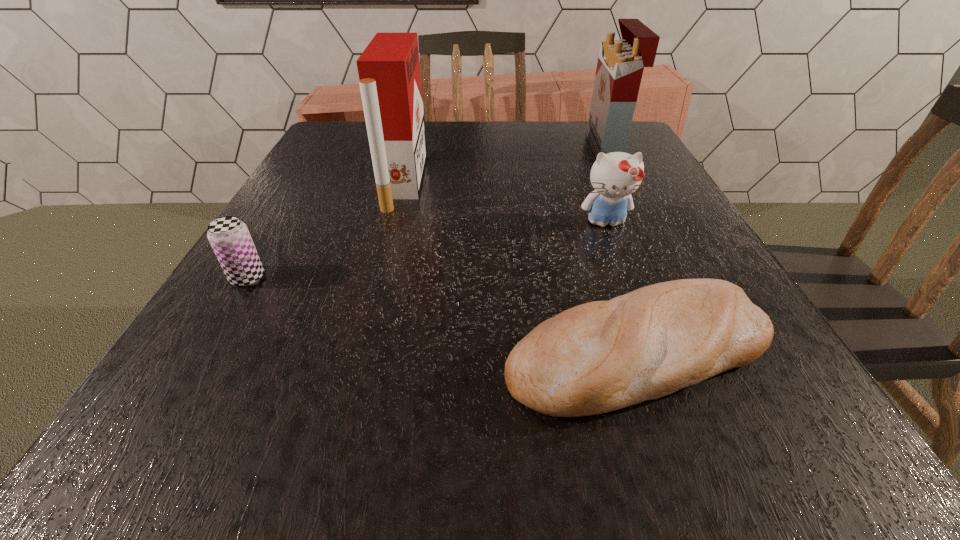
Find the location of a particular element. Image resolution: width=960 pixels, height=540 pixels. object that is at the near right corner is located at coordinates (601, 356).

Find the location of a particular element. The height and width of the screenshot is (540, 960). vacant space at the far edge of the desktop is located at coordinates (571, 136).

Locate an element on the screen. The height and width of the screenshot is (540, 960). free space at the left edge of the desktop is located at coordinates (300, 308).

I want to click on free region at the right edge, so click(x=656, y=177).

Find the location of a particular element. vacant region at the far left corner of the desktop is located at coordinates (x=351, y=121).

You are a GUI agent. You are given a task and a screenshot of the screen. Output one action in this format:
    pyautogui.click(x=<x>, y=<y>)
    Task: Click on the vacant region at the far right corner of the desktop
    The height and width of the screenshot is (540, 960).
    Given the screenshot: What is the action you would take?
    pyautogui.click(x=641, y=152)

Identify the location of free spot between the bread and the right cigarette case. (622, 250).

This screenshot has height=540, width=960. I want to click on free space between the nearest object and the kitten, so click(621, 287).

You are a GUI agent. You are given a task and a screenshot of the screen. Output one action in this format:
    pyautogui.click(x=<x>, y=<y>)
    Task: Click on the blank region between the second shortest object and the bread
    
    Given the screenshot: What is the action you would take?
    pyautogui.click(x=443, y=315)

This screenshot has height=540, width=960. What are the coordinates of `vacant region between the bread and the third tallest object` in the screenshot? It's located at (621, 287).